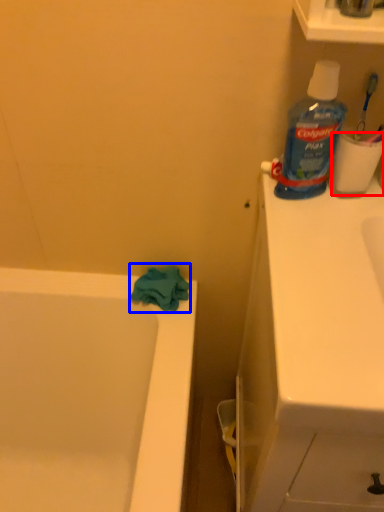
Question: Which object appears closest to the camera in this image, toilet paper (highlighted by a red box) or bath towel (highlighted by a blue box)?

Choices:
 (A) toilet paper
 (B) bath towel

Answer: (A)